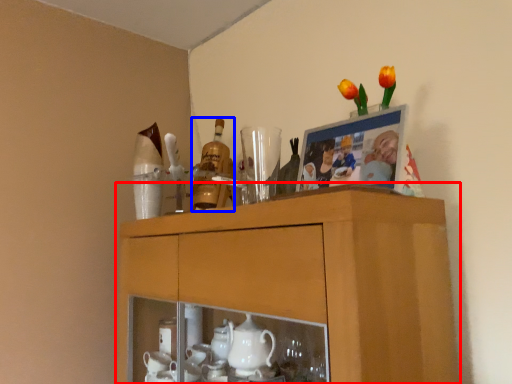
Question: Which object is closer to the camera taking this photo, cabinetry (highlighted by a red box) or bottle (highlighted by a blue box)?

Choices:
 (A) cabinetry
 (B) bottle

Answer: (A)